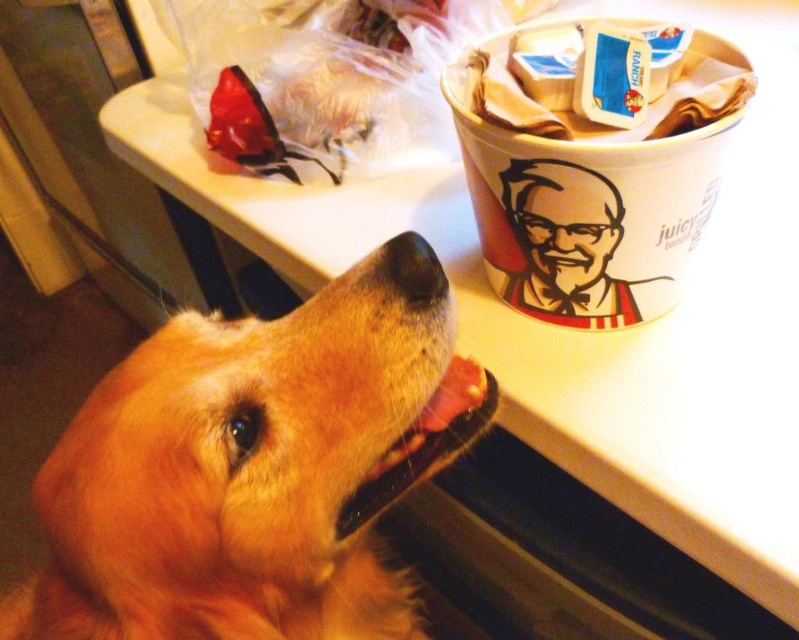
Does golden fur dog at center have a greater height compared to white paper cup at upper right?

Yes, golden fur dog at center is taller than white paper cup at upper right.

The height and width of the screenshot is (640, 799). Describe the element at coordinates (256, 468) in the screenshot. I see `golden fur dog at center` at that location.

Locate an element on the screen. golden fur dog at center is located at coordinates (256, 468).

I want to click on golden fur dog at center, so click(256, 468).